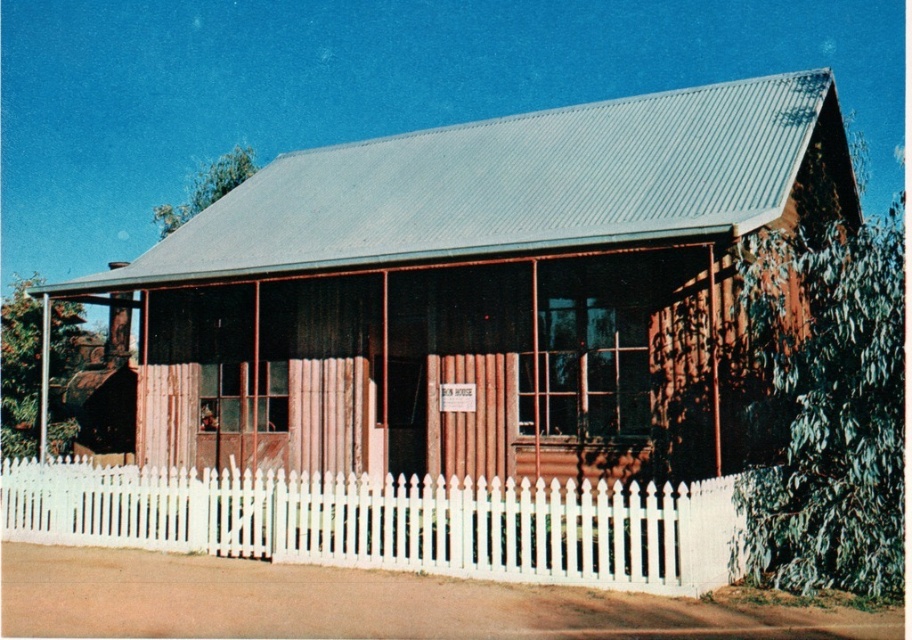
Question: Can you confirm if brown wooden hut at center is positioned to the left of white picket fence at center?

Choices:
 (A) yes
 (B) no

Answer: (B)

Question: Does brown wooden hut at center have a smaller size compared to white picket fence at center?

Choices:
 (A) yes
 (B) no

Answer: (B)

Question: Is brown wooden hut at center to the left of white picket fence at center from the viewer's perspective?

Choices:
 (A) yes
 (B) no

Answer: (B)

Question: Which point is closer to the camera taking this photo?

Choices:
 (A) (330, 308)
 (B) (340, 544)

Answer: (B)